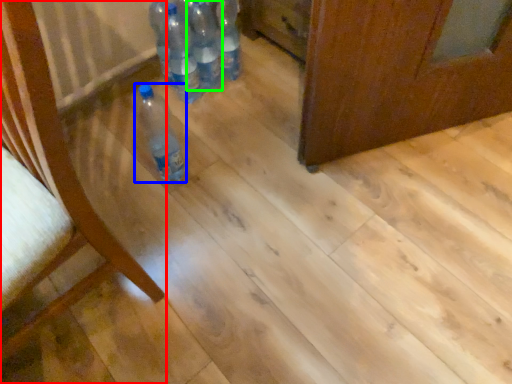
Question: Estimate the real-world distances between objects in this image. Which object is farther from furniture (highlighted by a red box), bottle (highlighted by a blue box) or bottle (highlighted by a green box)?

Choices:
 (A) bottle
 (B) bottle

Answer: (B)